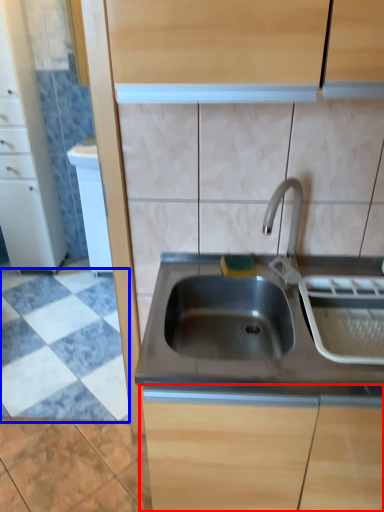
Question: Which object appears farthest to the camera in this image, cabinetry (highlighted by a red box) or ceramic tile (highlighted by a blue box)?

Choices:
 (A) cabinetry
 (B) ceramic tile

Answer: (B)